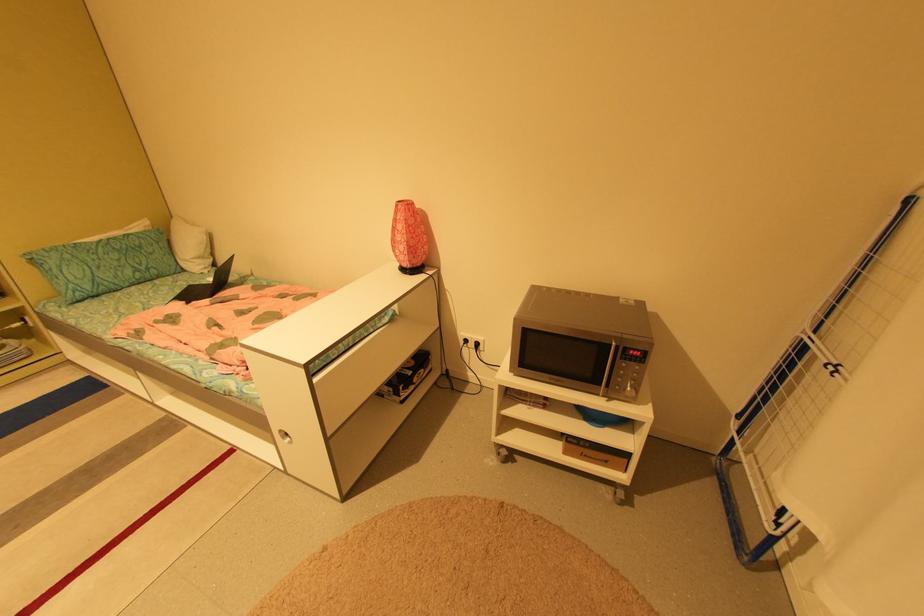
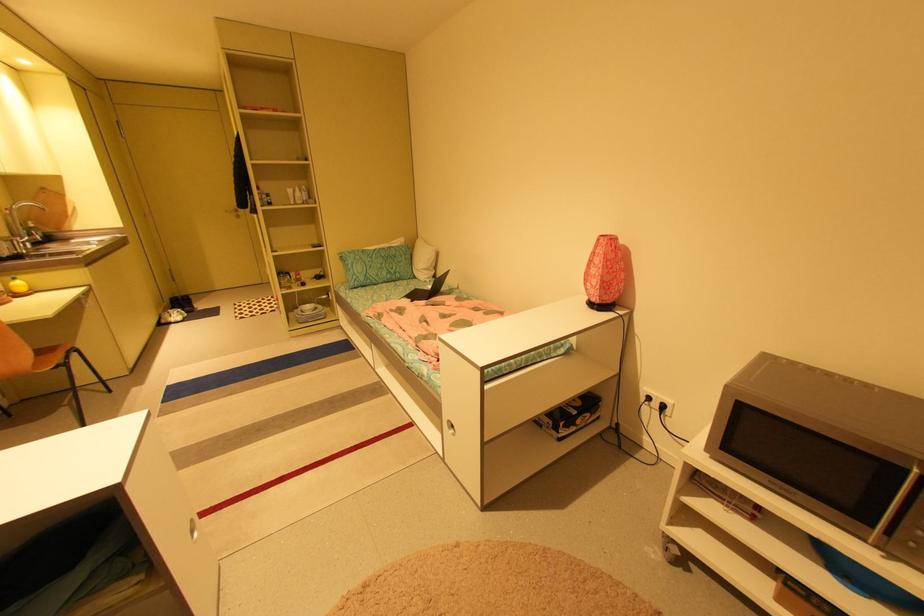
Find the pixel in the second image that matches pixel 210 284 in the first image.

(431, 290)